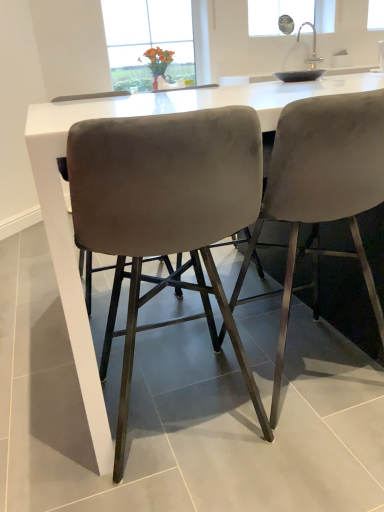
Question: Does velvet grey bar stool at center, positioned as the 2th chair in left-to-right order, come behind velvet grey chair at center, the 1th chair positioned from the left?

Choices:
 (A) yes
 (B) no

Answer: (A)

Question: Is velvet grey bar stool at center, positioned as the 2th chair in left-to-right order, to the left of velvet grey chair at center, the 1th chair positioned from the left, from the viewer's perspective?

Choices:
 (A) yes
 (B) no

Answer: (B)

Question: Is velvet grey bar stool at center, positioned as the 2th chair in left-to-right order, touching velvet grey chair at center, the 1th chair positioned from the left?

Choices:
 (A) no
 (B) yes

Answer: (A)

Question: Can you confirm if velvet grey bar stool at center, positioned as the 2th chair in left-to-right order, is taller than velvet grey chair at center, the second chair from the right?

Choices:
 (A) yes
 (B) no

Answer: (A)

Question: Can you confirm if velvet grey bar stool at center, positioned as the 2th chair in left-to-right order, is smaller than velvet grey chair at center, the second chair from the right?

Choices:
 (A) no
 (B) yes

Answer: (A)

Question: Is velvet grey chair at center, the 1th chair positioned from the left, located within velvet grey bar stool at center, which ranks as the first chair in right-to-left order?

Choices:
 (A) no
 (B) yes

Answer: (A)

Question: From a real-world perspective, does velvet grey chair at center, the 1th chair positioned from the left, stand above velvet grey bar stool at center, which ranks as the first chair in right-to-left order?

Choices:
 (A) no
 (B) yes

Answer: (A)

Question: Can you confirm if velvet grey chair at center, the 1th chair positioned from the left, is positioned to the left of velvet grey bar stool at center, which ranks as the first chair in right-to-left order?

Choices:
 (A) yes
 (B) no

Answer: (A)

Question: Is velvet grey chair at center, the 1th chair positioned from the left, thinner than velvet grey bar stool at center, which ranks as the first chair in right-to-left order?

Choices:
 (A) no
 (B) yes

Answer: (B)

Question: From the image's perspective, does velvet grey chair at center, the second chair from the right, appear lower than velvet grey bar stool at center, which ranks as the first chair in right-to-left order?

Choices:
 (A) yes
 (B) no

Answer: (A)

Question: Is velvet grey chair at center, the second chair from the right, oriented away from velvet grey bar stool at center, which ranks as the first chair in right-to-left order?

Choices:
 (A) no
 (B) yes

Answer: (A)

Question: Is velvet grey chair at center, the 1th chair positioned from the left, closer to the viewer compared to velvet grey bar stool at center, which ranks as the first chair in right-to-left order?

Choices:
 (A) no
 (B) yes

Answer: (B)

Question: From a real-world perspective, is velvet grey bar stool at center, positioned as the 2th chair in left-to-right order, physically located above or below velvet grey chair at center, the second chair from the right?

Choices:
 (A) above
 (B) below

Answer: (A)